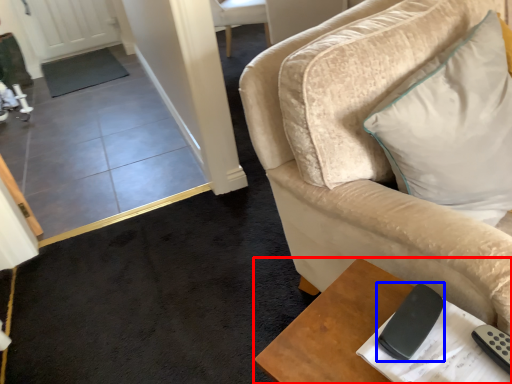
Question: Among these objects, which one is nearest to the camera, table (highlighted by a red box) or remote (highlighted by a blue box)?

Choices:
 (A) table
 (B) remote

Answer: (A)